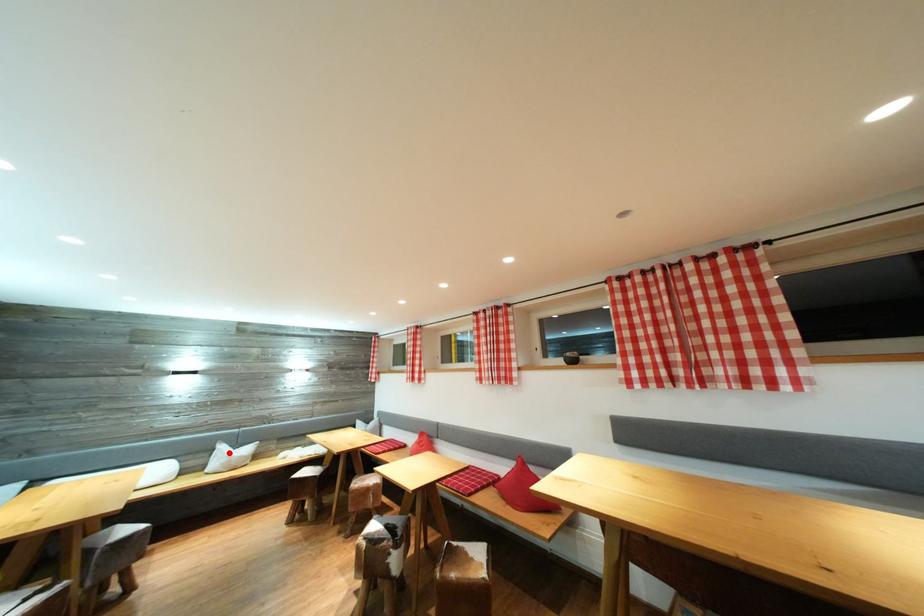
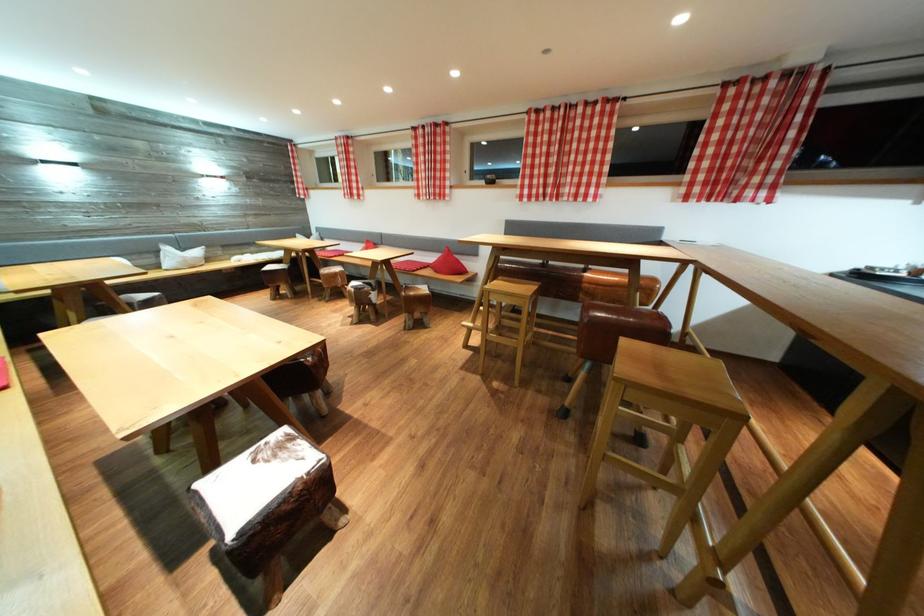
Locate, in the second image, the point that corresponds to the highlighted location in the first image.

(176, 254)